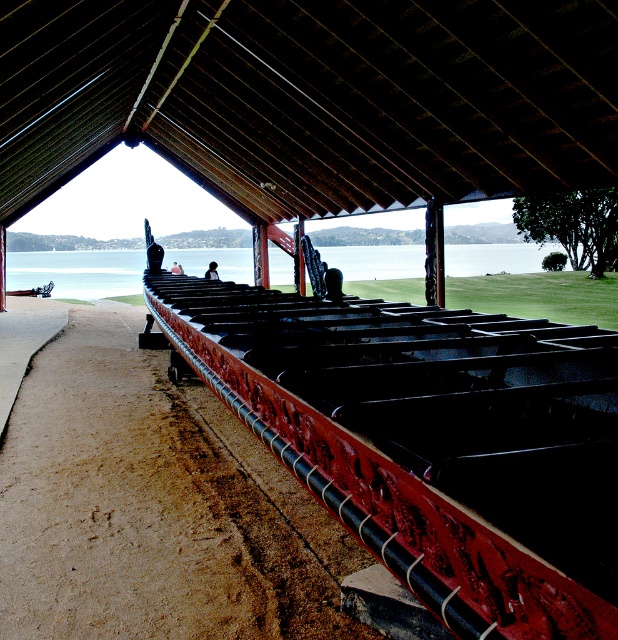
Which is behind, point (569, 378) or point (36, 435)?

Point (36, 435)

Describe the element at coordinates (431, 440) in the screenshot. I see `rustic wood canoe at center` at that location.

Find the location of a particular element. rustic wood canoe at center is located at coordinates (431, 440).

Which is more to the left, dark brown wooden roof at center or brown sandy dirt track at lower left?

dark brown wooden roof at center is more to the left.

Is dark brown wooden roof at center positioned at the back of brown sandy dirt track at lower left?

Yes, dark brown wooden roof at center is behind brown sandy dirt track at lower left.

This screenshot has height=640, width=618. What do you see at coordinates (311, 97) in the screenshot?
I see `dark brown wooden roof at center` at bounding box center [311, 97].

Where is `dark brown wooden roof at center`? The width and height of the screenshot is (618, 640). dark brown wooden roof at center is located at coordinates (311, 97).

Who is more distant from viewer, (598, 630) or (174, 262)?

Positioned behind is point (174, 262).

Who is lower down, rustic wood canoe at center or light brown wooden person at center?

rustic wood canoe at center is lower down.

The height and width of the screenshot is (640, 618). In order to click on rustic wood canoe at center in this screenshot , I will do `click(431, 440)`.